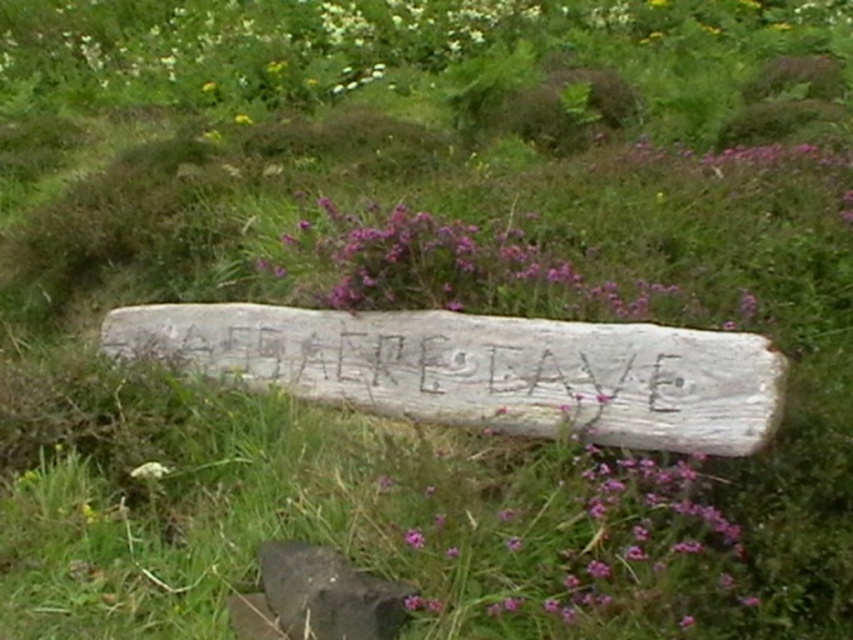
Describe the element at coordinates (328, 593) in the screenshot. I see `smooth gray stone at lower center` at that location.

Does smooth gray stone at lower center have a smaller size compared to white fluffy flower at lower left?

Actually, smooth gray stone at lower center might be larger than white fluffy flower at lower left.

The image size is (853, 640). Identify the location of smooth gray stone at lower center. (328, 593).

At what (x,y) coordinates should I click in order to perform the action: click on purple wood at center. Please return your answer as a coordinate pair (x, y). The height and width of the screenshot is (640, 853). Looking at the image, I should click on (445, 268).

Is purple wood at center above white fluffy flower at lower left?

Yes, purple wood at center is above white fluffy flower at lower left.

Between point (335, 250) and point (154, 477), which one is positioned in front?

Point (154, 477) is more forward.

At what (x,y) coordinates should I click in order to perform the action: click on purple wood at center. Please return your answer as a coordinate pair (x, y). This screenshot has width=853, height=640. Looking at the image, I should click on (445, 268).

From the picture: Is purple wood at center further to the viewer compared to smooth gray stone at lower center?

That is True.

Who is shorter, purple wood at center or smooth gray stone at lower center?

smooth gray stone at lower center

Is point (517, 244) closer to viewer compared to point (331, 605)?

No, it is not.

You are a GUI agent. You are given a task and a screenshot of the screen. Output one action in this format:
    pyautogui.click(x=<x>, y=<y>)
    Task: Click on the purple wood at center
    This screenshot has width=853, height=640.
    Given the screenshot: What is the action you would take?
    (445, 268)